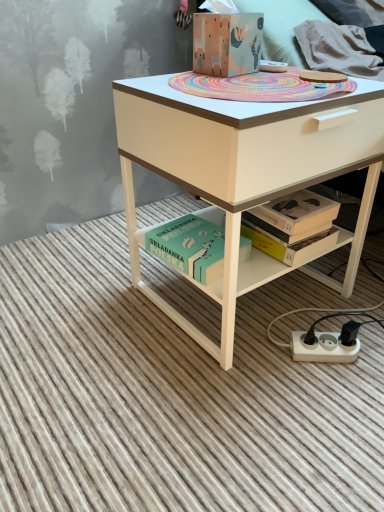
Question: Is wooden painted box at center surrounding white plastic power plugs and sockets at lower right?

Choices:
 (A) yes
 (B) no

Answer: (B)

Question: Is wooden painted box at center positioned with its back to white plastic power plugs and sockets at lower right?

Choices:
 (A) yes
 (B) no

Answer: (B)

Question: Is wooden painted box at center thinner than white plastic power plugs and sockets at lower right?

Choices:
 (A) no
 (B) yes

Answer: (A)

Question: Can you confirm if wooden painted box at center is bigger than white plastic power plugs and sockets at lower right?

Choices:
 (A) no
 (B) yes

Answer: (B)

Question: Is wooden painted box at center positioned in front of white plastic power plugs and sockets at lower right?

Choices:
 (A) yes
 (B) no

Answer: (A)

Question: From the image's perspective, is matte white desk at center above or below green matte book at lower center?

Choices:
 (A) below
 (B) above

Answer: (B)

Question: Visually, is matte white desk at center positioned to the left or to the right of green matte book at lower center?

Choices:
 (A) right
 (B) left

Answer: (A)

Question: Relative to green matte book at lower center, is matte white desk at center in front or behind?

Choices:
 (A) behind
 (B) front

Answer: (B)

Question: From a real-world perspective, is matte white desk at center physically located above or below green matte book at lower center?

Choices:
 (A) below
 (B) above

Answer: (B)

Question: Would you say green matte book at lower center is to the left or to the right of matte white desk at center in the picture?

Choices:
 (A) right
 (B) left

Answer: (B)

Question: Is point (196, 266) positioned closer to the camera than point (360, 137)?

Choices:
 (A) closer
 (B) farther

Answer: (B)

Question: From the image's perspective, is green matte book at lower center located above or below matte white desk at center?

Choices:
 (A) above
 (B) below

Answer: (B)

Question: From a real-world perspective, is green matte book at lower center above or below matte white desk at center?

Choices:
 (A) below
 (B) above

Answer: (A)

Question: Is matte white desk at center wider or thinner than white plastic power plugs and sockets at lower right?

Choices:
 (A) thin
 (B) wide

Answer: (B)

Question: From their relative heights in the image, would you say matte white desk at center is taller or shorter than white plastic power plugs and sockets at lower right?

Choices:
 (A) tall
 (B) short

Answer: (A)